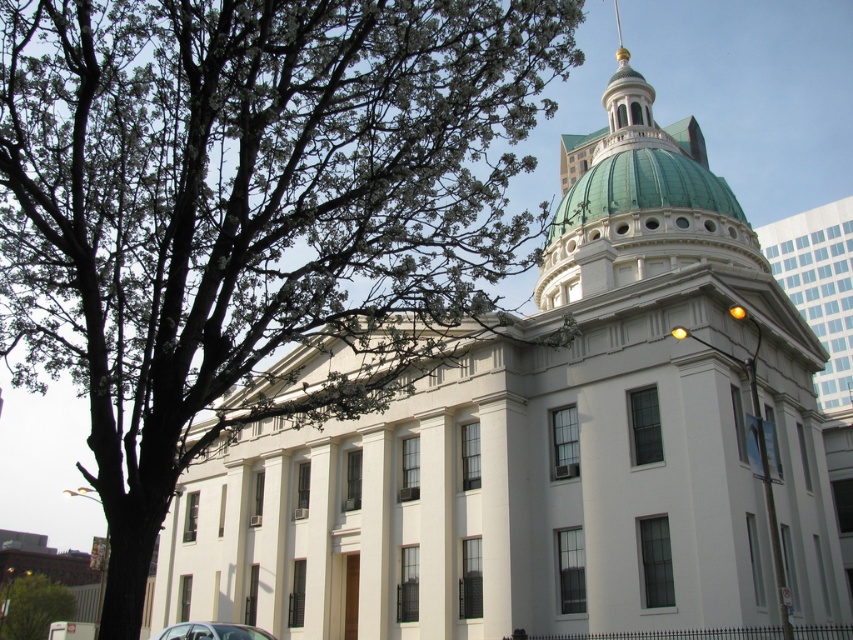
Can you confirm if green leafy tree at upper left is bigger than metallic silver car at lower left?

Correct, green leafy tree at upper left is larger in size than metallic silver car at lower left.

Is green leafy tree at upper left taller than metallic silver car at lower left?

Indeed, green leafy tree at upper left has a greater height compared to metallic silver car at lower left.

This screenshot has height=640, width=853. What are the coordinates of `green leafy tree at upper left` in the screenshot? It's located at (252, 212).

Between green leafy tree at upper left and green leafy tree at lower left, which one has more height?

Standing taller between the two is green leafy tree at upper left.

Does green leafy tree at upper left have a greater height compared to green leafy tree at lower left?

Indeed, green leafy tree at upper left has a greater height compared to green leafy tree at lower left.

Image resolution: width=853 pixels, height=640 pixels. Find the location of `green leafy tree at upper left`. green leafy tree at upper left is located at coordinates (252, 212).

Locate an element on the screen. green leafy tree at upper left is located at coordinates (252, 212).

Which of these two, green leafy tree at lower left or metallic silver car at lower left, stands taller?

green leafy tree at lower left is taller.

Is point (15, 614) closer to viewer compared to point (219, 634)?

No, it is not.

Who is more forward, (26, 637) or (167, 636)?

Point (167, 636)

This screenshot has height=640, width=853. I want to click on green leafy tree at lower left, so click(32, 605).